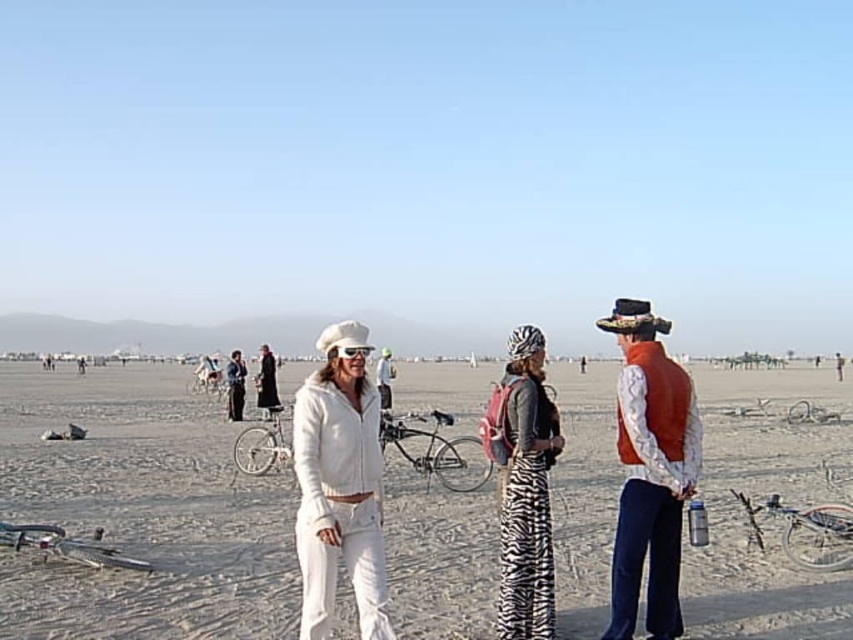
Is white cotton jacket at center further to camera compared to black velvet robe at center?

No, it is not.

What do you see at coordinates (140, 512) in the screenshot? The image size is (853, 640). I see `white cotton jacket at center` at bounding box center [140, 512].

Where is `white cotton jacket at center`? The width and height of the screenshot is (853, 640). white cotton jacket at center is located at coordinates (140, 512).

Does white cotton jacket at center appear under orange velvet vest at right?

Yes.

Is point (606, 417) positioned in front of point (650, 401)?

That is False.

Locate an element on the screen. The width and height of the screenshot is (853, 640). white cotton jacket at center is located at coordinates (140, 512).

Is white matte jacket at center taller than orange velvet vest at right?

No, white matte jacket at center is not taller than orange velvet vest at right.

Does white matte jacket at center have a lesser height compared to orange velvet vest at right?

Yes.

Does point (335, 468) come behind point (631, 476)?

No, (335, 468) is closer to viewer.

At what (x,y) coordinates should I click in order to perform the action: click on white matte jacket at center. Please return your answer as a coordinate pair (x, y). Image resolution: width=853 pixels, height=640 pixels. Looking at the image, I should click on (339, 484).